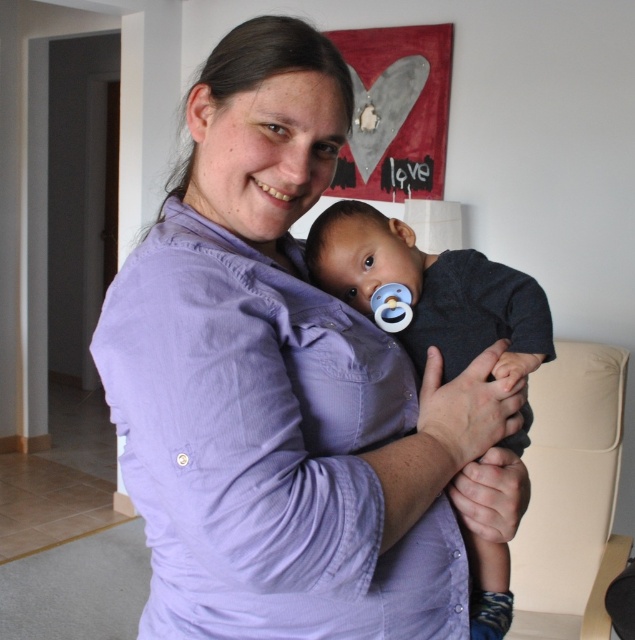
Between purple cotton shirt at center and dark blue fabric baby at center, which one is positioned higher?

purple cotton shirt at center is above.

Who is more distant from viewer, (272, 268) or (514, 353)?

The point (514, 353) is behind.

The width and height of the screenshot is (635, 640). What are the coordinates of `purple cotton shirt at center` in the screenshot? It's located at (284, 388).